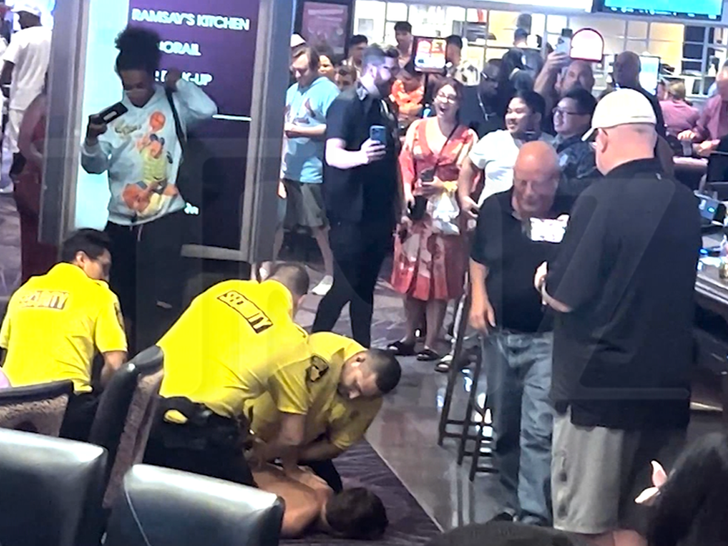
You are a GUI agent. You are given a task and a screenshot of the screen. Output one action in this format:
    pyautogui.click(x=<x>, y=<y>)
    Task: Click on the chairs
    The width and height of the screenshot is (728, 546).
    Given the screenshot: What is the action you would take?
    point(68,490), point(159,496), point(141,391), point(44,402)